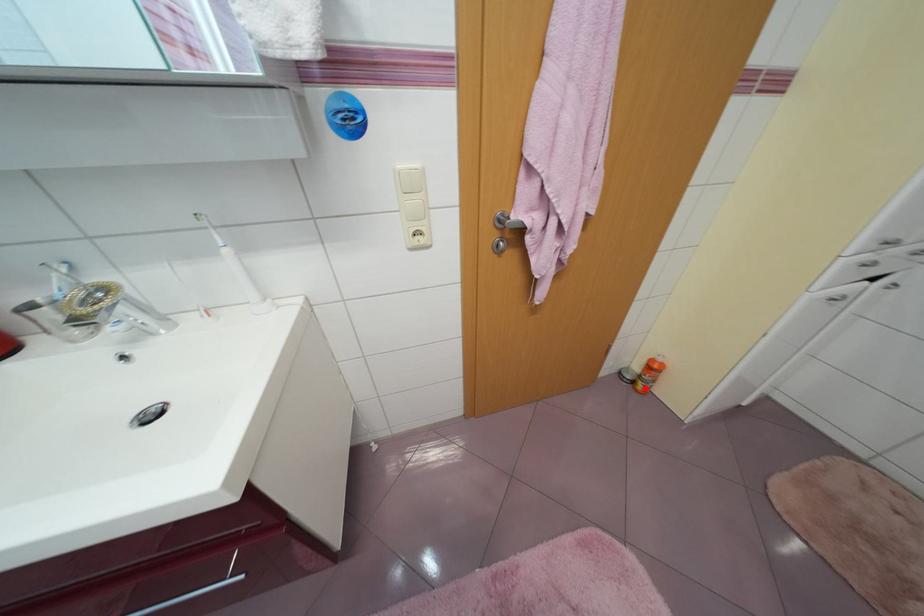
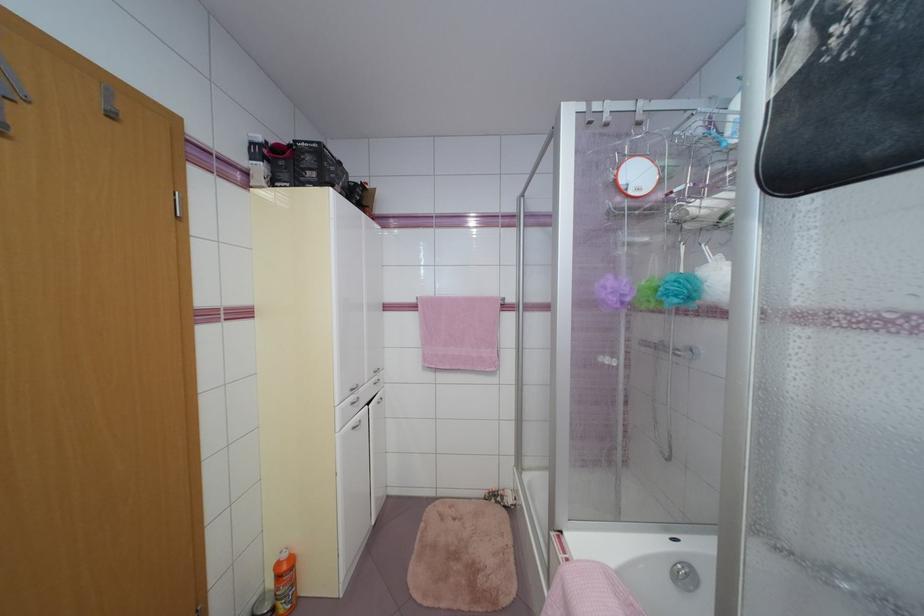
Question: I am providing you with two images of the same scene from different viewpoints. Given a red point in image1, look at the same physical point in image2. Is it:

Choices:
 (A) Closer to the viewpoint
 (B) Farther from the viewpoint

Answer: (B)